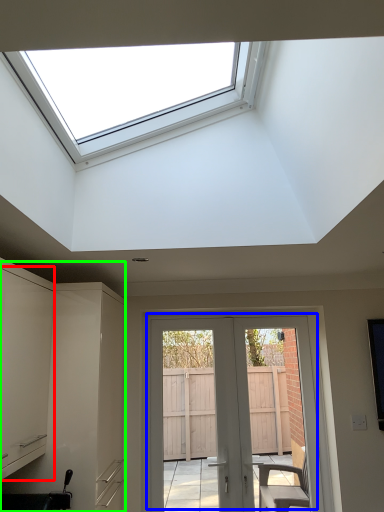
Question: Based on their relative distances, which object is farther from cabinetry (highlighted by a red box)? Choose from door (highlighted by a blue box) and cabinetry (highlighted by a green box).

Choices:
 (A) door
 (B) cabinetry

Answer: (A)